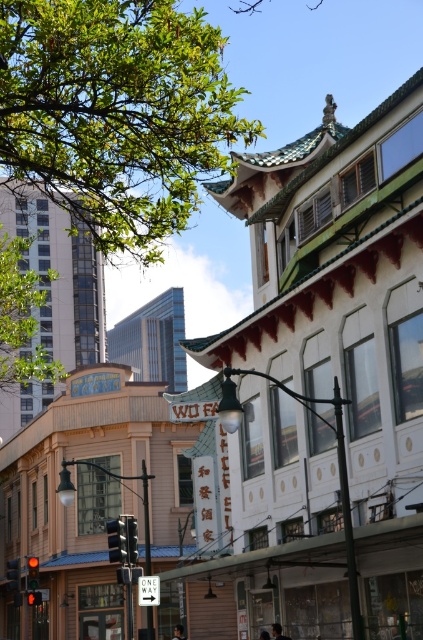
Question: Does dark hair person at center have a greater width compared to smooth skin face at center?

Choices:
 (A) yes
 (B) no

Answer: (A)

Question: Is dark hair person at center wider than smooth skin face at center?

Choices:
 (A) no
 (B) yes

Answer: (B)

Question: Which of the following is the farthest from the observer?

Choices:
 (A) (268, 636)
 (B) (184, 636)
 (C) (279, 630)

Answer: (B)

Question: Which of the following is the closest to the observer?

Choices:
 (A) smooth skin face at center
 (B) dark hair person at center

Answer: (A)

Question: Is dark hair person at center positioned behind smooth skin face at center?

Choices:
 (A) no
 (B) yes

Answer: (B)

Question: Which point appears closest to the camera in this image?

Choices:
 (A) (269, 636)
 (B) (183, 628)

Answer: (A)